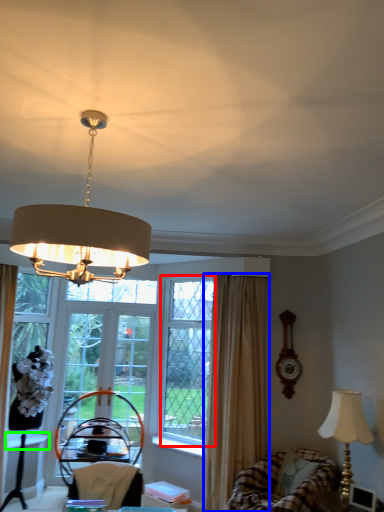
Question: Which is nearer to the window screen (highlighted by a red box)? curtain (highlighted by a blue box) or window sill (highlighted by a green box).

Choices:
 (A) curtain
 (B) window sill

Answer: (A)